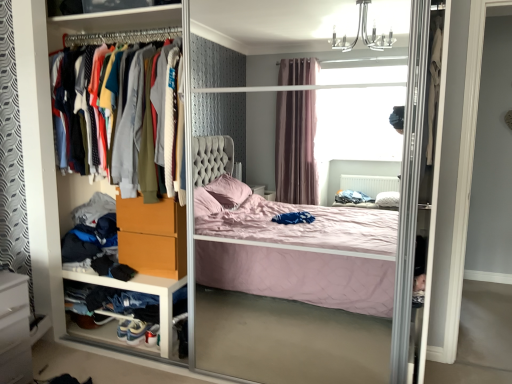
The height and width of the screenshot is (384, 512). I want to click on vacant space in front of white plastic drawer at lower left, so click(108, 361).